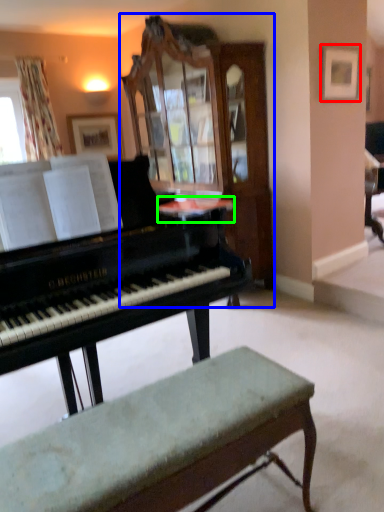
Question: Which object is the farthest from picture frame (highlighted by a red box)? Choose among these: cabinetry (highlighted by a blue box) or table (highlighted by a green box).

Choices:
 (A) cabinetry
 (B) table

Answer: (B)